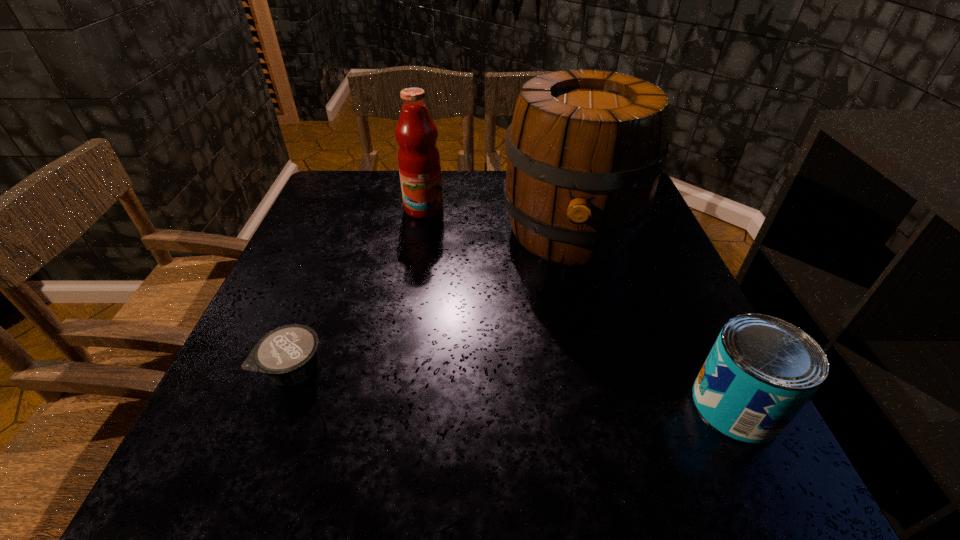
At what (x,y) coordinates should I click in order to perform the action: click on free space between the yogurt and the can. Please return your answer as a coordinate pair (x, y). Image resolution: width=960 pixels, height=540 pixels. Looking at the image, I should click on (515, 387).

At what (x,y) coordinates should I click in order to perform the action: click on free space between the second object from left to right and the can. Please return your answer as a coordinate pair (x, y). This screenshot has height=540, width=960. Looking at the image, I should click on (580, 307).

Identify the location of free space that is in between the cider and the third object from right to left. [x=497, y=220].

Locate an element on the screen. The height and width of the screenshot is (540, 960). vacant space that's between the fruit juice and the cider is located at coordinates (497, 220).

What are the coordinates of `blank region between the fruit juice and the shortest object` in the screenshot? It's located at (359, 289).

Locate an element on the screen. The height and width of the screenshot is (540, 960). free space between the cider and the fruit juice is located at coordinates (497, 220).

The image size is (960, 540). What are the coordinates of `free point between the fruit juice and the third tallest object` in the screenshot? It's located at (580, 307).

The width and height of the screenshot is (960, 540). What are the coordinates of `the third closest object relative to the yogurt` in the screenshot? It's located at 761,371.

Identify the location of object identified as the closest to the cider. (419, 165).